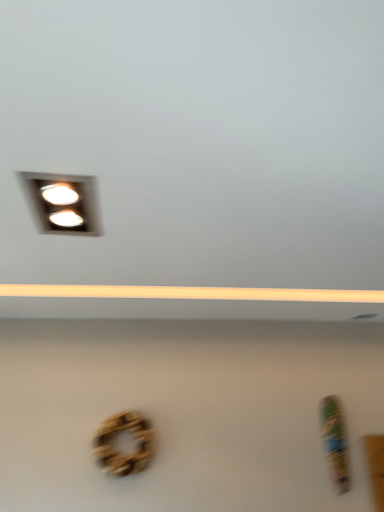
In order to face matte white recessed lights at upper left, should I rotate leftwards or rightwards?

→ It's best to rotate left around 16.727 degrees.

The width and height of the screenshot is (384, 512). Find the location of `matte white recessed lights at upper left`. matte white recessed lights at upper left is located at coordinates (64, 203).

Describe the element at coordinates (64, 203) in the screenshot. I see `matte white recessed lights at upper left` at that location.

The height and width of the screenshot is (512, 384). What are the coordinates of `wooden wreath at center` in the screenshot? It's located at (118, 450).

Image resolution: width=384 pixels, height=512 pixels. Describe the element at coordinates (118, 450) in the screenshot. I see `wooden wreath at center` at that location.

Locate an element on the screen. matte white recessed lights at upper left is located at coordinates (64, 203).

Does wooden wreath at center appear on the right side of matte white recessed lights at upper left?

Indeed, wooden wreath at center is positioned on the right side of matte white recessed lights at upper left.

Relative to matte white recessed lights at upper left, is wooden wreath at center in front or behind?

wooden wreath at center is positioned farther from the viewer than matte white recessed lights at upper left.

Is point (104, 452) positioned in front of point (70, 225)?

Yes.

From the image's perspective, is wooden wreath at center located above or below matte white recessed lights at upper left?

wooden wreath at center is situated lower than matte white recessed lights at upper left in the image.

From a real-world perspective, relative to matte white recessed lights at upper left, is wooden wreath at center vertically above or below?

Clearly, from a real-world perspective, wooden wreath at center is below matte white recessed lights at upper left.

Looking at their sizes, would you say wooden wreath at center is wider or thinner than matte white recessed lights at upper left?

Clearly, wooden wreath at center has less width compared to matte white recessed lights at upper left.

Who is shorter, wooden wreath at center or matte white recessed lights at upper left?

matte white recessed lights at upper left.

Considering the relative sizes of wooden wreath at center and matte white recessed lights at upper left in the image provided, is wooden wreath at center smaller than matte white recessed lights at upper left?

No, wooden wreath at center is not smaller than matte white recessed lights at upper left.

Is wooden wreath at center surrounding matte white recessed lights at upper left?

No, wooden wreath at center does not contain matte white recessed lights at upper left.

Would you say wooden wreath at center is a long distance from matte white recessed lights at upper left?

Yes.

Based on the photo, is matte white recessed lights at upper left at the back of wooden wreath at center?

That's not correct — wooden wreath at center is not looking away from matte white recessed lights at upper left.

Measure the distance between wooden wreath at center and matte white recessed lights at upper left.

They are 1.28 meters apart.

You are a GUI agent. You are given a task and a screenshot of the screen. Output one action in this format:
    pyautogui.click(x=<x>, y=<y>)
    Task: Click on the bagel behind the matte white recessed lights at upper left
    This screenshot has width=384, height=512.
    Given the screenshot: What is the action you would take?
    pyautogui.click(x=118, y=450)

Can you confirm if matte white recessed lights at upper left is positioned to the right of wooden wreath at center?

No, matte white recessed lights at upper left is not to the right of wooden wreath at center.

In the image, is matte white recessed lights at upper left positioned in front of or behind wooden wreath at center?

matte white recessed lights at upper left is in front of wooden wreath at center.

Does point (35, 182) come behind point (112, 464)?

No, it is in front of (112, 464).

From the image's perspective, which object appears higher, matte white recessed lights at upper left or wooden wreath at center?

Result: matte white recessed lights at upper left appears higher in the image.

From a real-world perspective, is matte white recessed lights at upper left located higher than wooden wreath at center?

Yes, from a real-world perspective, matte white recessed lights at upper left is on top of wooden wreath at center.

Does matte white recessed lights at upper left have a greater width compared to wooden wreath at center?

Yes.

Can you confirm if matte white recessed lights at upper left is shorter than wooden wreath at center?

Correct, matte white recessed lights at upper left is not as tall as wooden wreath at center.

Looking at the image, does matte white recessed lights at upper left seem bigger or smaller compared to wooden wreath at center?

Clearly, matte white recessed lights at upper left is smaller in size than wooden wreath at center.

Which is correct: matte white recessed lights at upper left is inside wooden wreath at center, or outside of it?

matte white recessed lights at upper left is spatially situated outside wooden wreath at center.

Is matte white recessed lights at upper left next to wooden wreath at center?

matte white recessed lights at upper left and wooden wreath at center are not in contact.

Is matte white recessed lights at upper left facing towards wooden wreath at center?

No, matte white recessed lights at upper left is not oriented towards wooden wreath at center.

In order to click on bagel that is on the right side of matte white recessed lights at upper left in this screenshot , I will do `click(118, 450)`.

At what (x,y) coordinates should I click in order to perform the action: click on bagel below the matte white recessed lights at upper left (from the image's perspective). Please return your answer as a coordinate pair (x, y). Looking at the image, I should click on (118, 450).

Image resolution: width=384 pixels, height=512 pixels. I want to click on bagel that is under the matte white recessed lights at upper left (from a real-world perspective), so click(x=118, y=450).